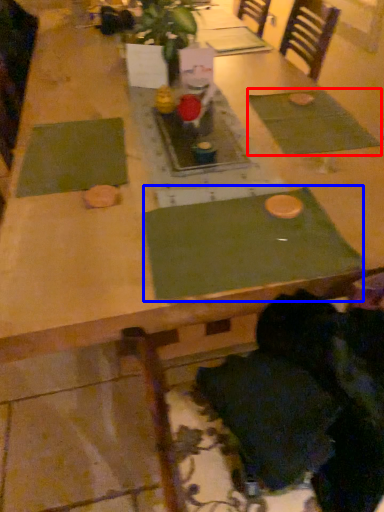
Question: Which object is further to the camera taking this photo, place mat (highlighted by a red box) or place mat (highlighted by a blue box)?

Choices:
 (A) place mat
 (B) place mat

Answer: (A)